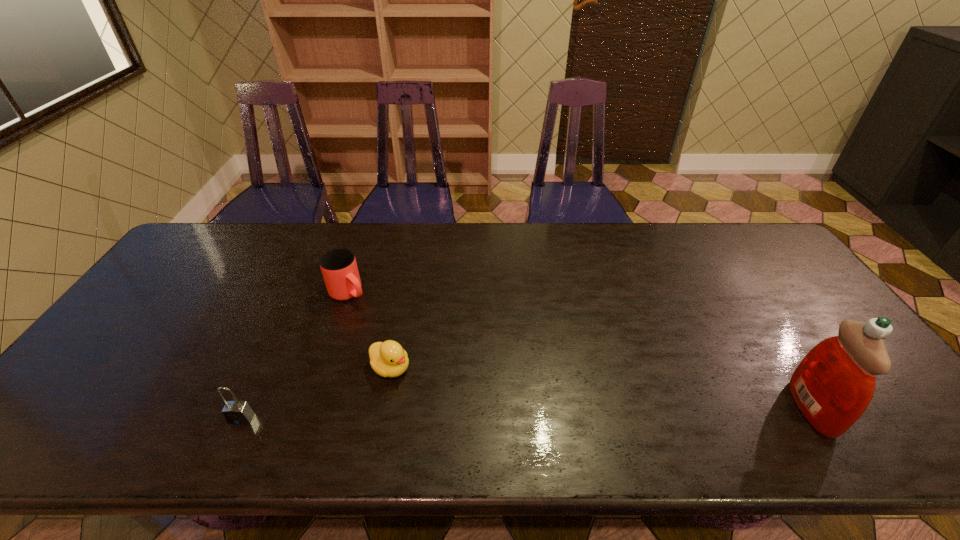
In the image, there is a desktop. In order to click on vacant region at the far left corner in this screenshot , I will do `click(203, 230)`.

I want to click on vacant space at the near right corner of the desktop, so click(x=883, y=390).

The height and width of the screenshot is (540, 960). Identify the location of vacant space in between the rightmost object and the second object from left to right. (580, 351).

Find the location of a particular element. free spot between the padlock and the farthest object is located at coordinates (295, 356).

This screenshot has width=960, height=540. What are the coordinates of `free spot between the padlock and the detergent` in the screenshot? It's located at [x=526, y=413].

This screenshot has height=540, width=960. Find the location of `free spot between the padlock and the rightmost object`. free spot between the padlock and the rightmost object is located at coordinates (526, 413).

Locate an element on the screen. vacant area that lies between the cup and the duckling is located at coordinates (370, 330).

Where is `vacant region between the padlock and the third object from right to left`? The width and height of the screenshot is (960, 540). vacant region between the padlock and the third object from right to left is located at coordinates (295, 356).

Where is `unoccupied position between the duckling and the cup`? unoccupied position between the duckling and the cup is located at coordinates (370, 330).

The height and width of the screenshot is (540, 960). I want to click on vacant region between the tallest object and the second object from right to left, so click(601, 388).